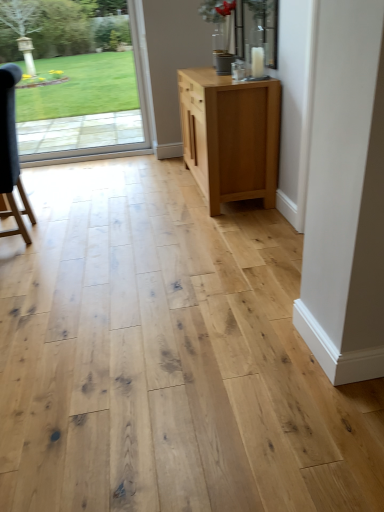
Locate an element on the screen. Image resolution: width=384 pixels, height=512 pixels. transparent glass door at upper left is located at coordinates (75, 79).

Considering the positions of objects natural wood cabinet at center and transparent glass door at upper left in the image provided, who is more to the right, natural wood cabinet at center or transparent glass door at upper left?

From the viewer's perspective, natural wood cabinet at center appears more on the right side.

Is natural wood cabinet at center next to transparent glass door at upper left and touching it?

natural wood cabinet at center is not next to transparent glass door at upper left, and they're not touching.

Is natural wood cabinet at center oriented away from transparent glass door at upper left?

natural wood cabinet at center is not turned away from transparent glass door at upper left.

From the image's perspective, which is above, transparent glass door at upper left or natural wood cabinet at center?

From the image's view, transparent glass door at upper left is above.

Looking at this image, can we say transparent glass door at upper left lies outside natural wood cabinet at center?

transparent glass door at upper left is positioned outside natural wood cabinet at center.

Considering the sizes of transparent glass door at upper left and natural wood cabinet at center in the image, is transparent glass door at upper left wider or thinner than natural wood cabinet at center?

Clearly, transparent glass door at upper left has less width compared to natural wood cabinet at center.

How much distance is there between transparent glass door at upper left and natural wood cabinet at center?

transparent glass door at upper left and natural wood cabinet at center are 10.02 feet apart.

Considering the sizes of objects natural wood cabinet at center and dark gray fabric chair at left in the image provided, who is shorter, natural wood cabinet at center or dark gray fabric chair at left?

Standing shorter between the two is natural wood cabinet at center.

Is natural wood cabinet at center oriented away from dark gray fabric chair at left?

No, dark gray fabric chair at left is not at the back of natural wood cabinet at center.

Where is `chair that appears in front of the natural wood cabinet at center`? The image size is (384, 512). chair that appears in front of the natural wood cabinet at center is located at coordinates (11, 152).

Measure the distance between natural wood cabinet at center and dark gray fabric chair at left.

4.72 feet.

Looking at this image, are transparent glass door at upper left and dark gray fabric chair at left located far from each other?

transparent glass door at upper left is far away from dark gray fabric chair at left.

What are the coordinates of `chair lying on the left of transparent glass door at upper left` in the screenshot? It's located at (11, 152).

In the scene shown: From the image's perspective, is transparent glass door at upper left located above or below dark gray fabric chair at left?

From the image's perspective, transparent glass door at upper left appears above dark gray fabric chair at left.

Which is more to the left, dark gray fabric chair at left or transparent glass door at upper left?

From the viewer's perspective, dark gray fabric chair at left appears more on the left side.

How distant is dark gray fabric chair at left from transparent glass door at upper left?

2.92 meters.

Is dark gray fabric chair at left smaller than transparent glass door at upper left?

Incorrect, dark gray fabric chair at left is not smaller in size than transparent glass door at upper left.

From the picture: Are dark gray fabric chair at left and transparent glass door at upper left located far from each other?

dark gray fabric chair at left is far away from transparent glass door at upper left.

Is dark gray fabric chair at left positioned far away from natural wood cabinet at center?

Yes, dark gray fabric chair at left and natural wood cabinet at center are located far from each other.

Between point (13, 133) and point (246, 117), which one is positioned behind?

The point (246, 117) is behind.

Considering the relative sizes of dark gray fabric chair at left and natural wood cabinet at center in the image provided, is dark gray fabric chair at left bigger than natural wood cabinet at center?

Incorrect, dark gray fabric chair at left is not larger than natural wood cabinet at center.

At what (x,y) coordinates should I click in order to perform the action: click on chest of drawers below the transparent glass door at upper left (from a real-world perspective). Please return your answer as a coordinate pair (x, y). The height and width of the screenshot is (512, 384). Looking at the image, I should click on (230, 136).

Where is `chest of drawers lying on the right of transparent glass door at upper left`? This screenshot has width=384, height=512. chest of drawers lying on the right of transparent glass door at upper left is located at coordinates pyautogui.click(x=230, y=136).

Looking at the image, which one is located further to natural wood cabinet at center, transparent glass door at upper left or dark gray fabric chair at left?

Among the two, transparent glass door at upper left is located further to natural wood cabinet at center.

When comparing their distances from transparent glass door at upper left, does dark gray fabric chair at left or natural wood cabinet at center seem closer?

The object closer to transparent glass door at upper left is dark gray fabric chair at left.

Which object lies further to the anchor point dark gray fabric chair at left, natural wood cabinet at center or transparent glass door at upper left?

transparent glass door at upper left.

Which object lies further to the anchor point dark gray fabric chair at left, transparent glass door at upper left or natural wood cabinet at center?

transparent glass door at upper left is positioned further to the anchor dark gray fabric chair at left.

When comparing their distances from natural wood cabinet at center, does dark gray fabric chair at left or transparent glass door at upper left seem closer?

Among the two, dark gray fabric chair at left is located nearer to natural wood cabinet at center.

When comparing their distances from transparent glass door at upper left, does natural wood cabinet at center or dark gray fabric chair at left seem closer?

Based on the image, dark gray fabric chair at left appears to be nearer to transparent glass door at upper left.

Locate an element on the screen. The width and height of the screenshot is (384, 512). door situated between dark gray fabric chair at left and natural wood cabinet at center from left to right is located at coordinates (75, 79).